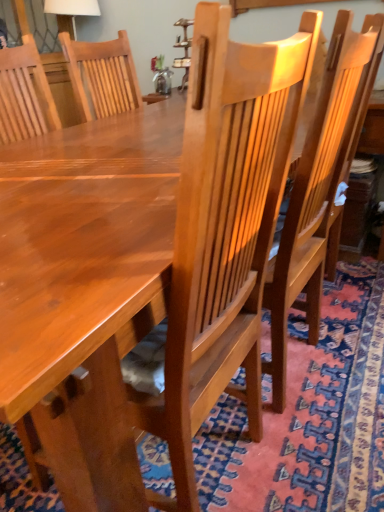
The height and width of the screenshot is (512, 384). Identify the location of blank space situated above carpeted floor at center (from a real-world perspective). (106, 148).